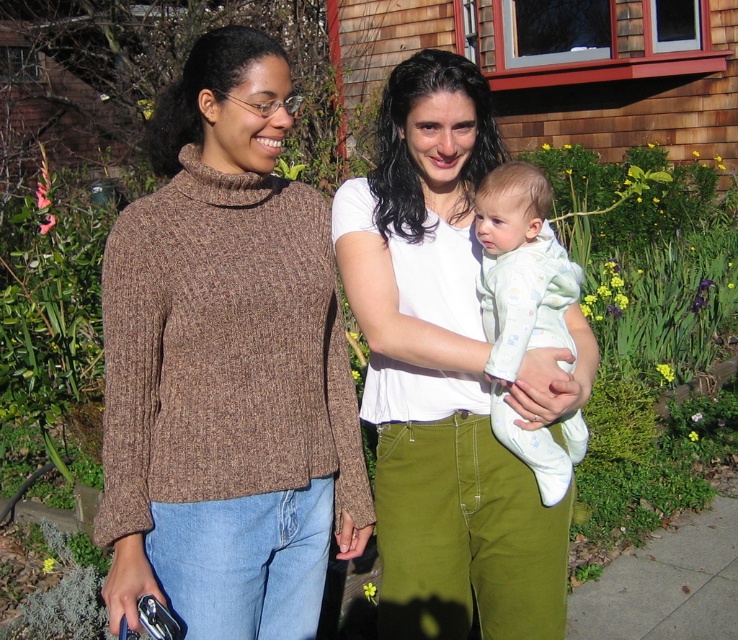
Which is more to the left, brown knitted sweater at left or white cotton shirt at center?

brown knitted sweater at left

Measure the distance between brown knitted sweater at left and camera.

The distance of brown knitted sweater at left from camera is 1.65 meters.

Does point (244, 547) lie behind point (382, 388)?

No, (244, 547) is in front of (382, 388).

Locate an element on the screen. The image size is (738, 640). brown knitted sweater at left is located at coordinates (227, 365).

Is point (313, 236) more distant than point (514, 182)?

No, (313, 236) is in front of (514, 182).

Who is more forward, (238, 541) or (565, 433)?

Positioned in front is point (238, 541).

You are a GUI agent. You are given a task and a screenshot of the screen. Output one action in this format:
    pyautogui.click(x=<x>, y=<y>)
    Task: Click on the brown knitted sweater at left
    
    Given the screenshot: What is the action you would take?
    pyautogui.click(x=227, y=365)

Is brown knitted sweater at left smaller than gray concrete sidewalk at lower right?

Incorrect, brown knitted sweater at left is not smaller in size than gray concrete sidewalk at lower right.

Who is lower down, brown knitted sweater at left or gray concrete sidewalk at lower right?

gray concrete sidewalk at lower right is lower down.

Between point (220, 88) and point (679, 554), which one is positioned behind?

The point (679, 554) is more distant.

Locate an element on the screen. The width and height of the screenshot is (738, 640). brown knitted sweater at left is located at coordinates (227, 365).